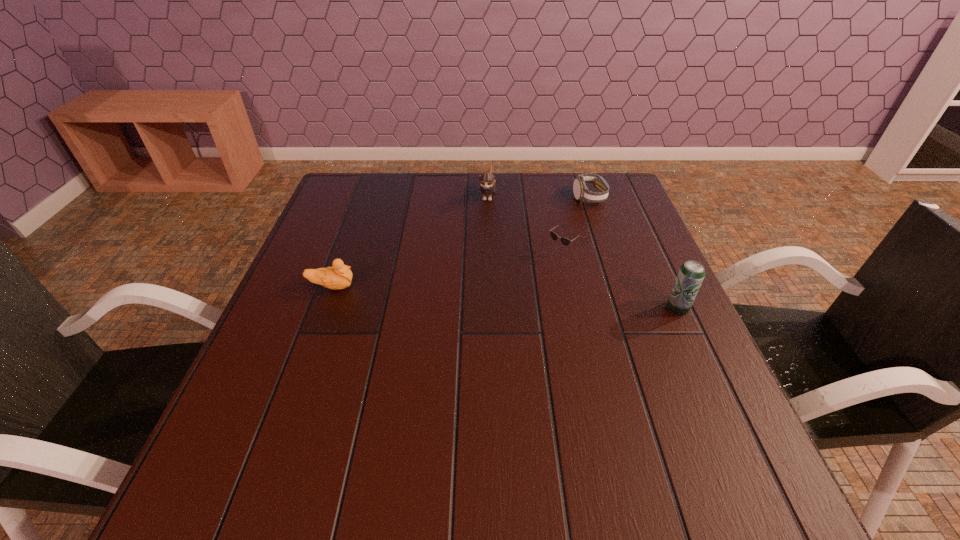
Image resolution: width=960 pixels, height=540 pixels. In order to click on vacant area at the near left corner of the desktop in this screenshot , I will do [318, 410].

Identify the location of vacant space at the far right corner of the desktop. The image size is (960, 540). (590, 205).

The width and height of the screenshot is (960, 540). I want to click on blank space at the near right corner of the desktop, so click(x=658, y=415).

The height and width of the screenshot is (540, 960). What are the coordinates of `vacant point located between the third farthest object and the fourth object from left to right` in the screenshot? It's located at (573, 225).

Where is `unoccupied area between the kitten and the rightmost object`? Image resolution: width=960 pixels, height=540 pixels. unoccupied area between the kitten and the rightmost object is located at coordinates (583, 252).

You are a GUI agent. You are given a task and a screenshot of the screen. Output one action in this format:
    pyautogui.click(x=<x>, y=<y>)
    Task: Click on the vacant area that lies between the second object from right to left and the fourth shortest object
    The width and height of the screenshot is (960, 540).
    Given the screenshot: What is the action you would take?
    pyautogui.click(x=538, y=196)

You are a GUI agent. You are given a task and a screenshot of the screen. Output one action in this format:
    pyautogui.click(x=<x>, y=<y>)
    Task: Click on the empty location between the second nearest object and the beer can
    
    Given the screenshot: What is the action you would take?
    pyautogui.click(x=505, y=298)

Locate an element on the screen. The width and height of the screenshot is (960, 540). free space between the tallest object and the kitten is located at coordinates (583, 252).

At what (x,y) coordinates should I click in order to perform the action: click on vacant point located between the duckling and the kitten. Please return your answer as a coordinate pair (x, y). Looking at the image, I should click on (410, 241).

You are a GUI agent. You are given a task and a screenshot of the screen. Output one action in this format:
    pyautogui.click(x=<x>, y=<y>)
    Task: Click on the unoccupied position between the second nearest object and the third farthest object
    Image resolution: width=960 pixels, height=540 pixels.
    Given the screenshot: What is the action you would take?
    pyautogui.click(x=444, y=270)